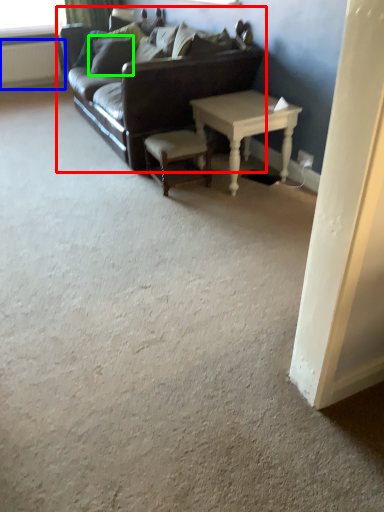
Question: Estimate the real-world distances between objects in this image. Which object is farther from studio couch (highlighted by a red box), radiator (highlighted by a blue box) or pillow (highlighted by a green box)?

Choices:
 (A) radiator
 (B) pillow

Answer: (A)